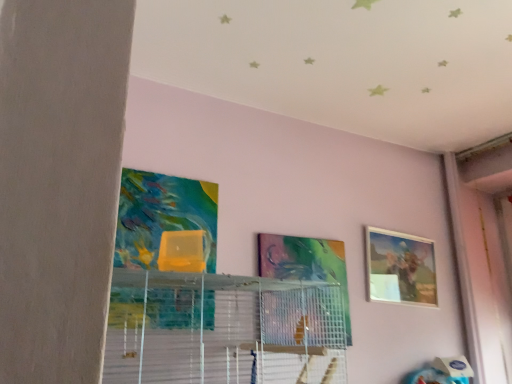
Question: From a real-world perspective, is clear plastic shelf at center under matte wooden picture frame at upper right, which appears as the 1th picture frame when viewed from the back?

Choices:
 (A) no
 (B) yes

Answer: (B)

Question: Does clear plastic shelf at center have a lesser height compared to matte wooden picture frame at upper right, which appears as the 1th picture frame when viewed from the back?

Choices:
 (A) yes
 (B) no

Answer: (A)

Question: Is clear plastic shelf at center further to the viewer compared to matte wooden picture frame at upper right, marked as the second picture frame in a left-to-right arrangement?

Choices:
 (A) no
 (B) yes

Answer: (A)

Question: Is clear plastic shelf at center to the left of matte wooden picture frame at upper right, which ranks as the second picture frame in front-to-back order, from the viewer's perspective?

Choices:
 (A) no
 (B) yes

Answer: (B)

Question: From the image's perspective, is clear plastic shelf at center below matte wooden picture frame at upper right, marked as the second picture frame in a left-to-right arrangement?

Choices:
 (A) yes
 (B) no

Answer: (A)

Question: Based on their positions, is clear plastic shelf at center located to the left or right of metallic silver picture frame at center, which appears as the 2th picture frame when viewed from the back?

Choices:
 (A) left
 (B) right

Answer: (A)

Question: In terms of height, does clear plastic shelf at center look taller or shorter compared to metallic silver picture frame at center, which appears as the 2th picture frame when viewed from the back?

Choices:
 (A) tall
 (B) short

Answer: (B)

Question: Is point (174, 354) closer or farther from the camera than point (267, 274)?

Choices:
 (A) closer
 (B) farther

Answer: (A)

Question: Considering their positions, is clear plastic shelf at center located in front of or behind metallic silver picture frame at center, which appears as the second picture frame when viewed from the right?

Choices:
 (A) behind
 (B) front

Answer: (B)

Question: Is matte wooden picture frame at upper right, which ranks as the second picture frame in front-to-back order, taller or shorter than metallic silver picture frame at center, which appears as the second picture frame when viewed from the right?

Choices:
 (A) short
 (B) tall

Answer: (A)

Question: From a real-world perspective, is matte wooden picture frame at upper right, which is the first picture frame in right-to-left order, above or below metallic silver picture frame at center, which is the first picture frame from front to back?

Choices:
 (A) below
 (B) above

Answer: (B)

Question: Does point (407, 299) appear closer or farther from the camera than point (347, 317)?

Choices:
 (A) farther
 (B) closer

Answer: (A)

Question: Is matte wooden picture frame at upper right, which ranks as the second picture frame in front-to-back order, inside or outside of metallic silver picture frame at center, which appears as the second picture frame when viewed from the right?

Choices:
 (A) inside
 (B) outside

Answer: (B)

Question: Considering the positions of metallic silver picture frame at center, the first picture frame in the left-to-right sequence, and matte wooden picture frame at upper right, marked as the second picture frame in a left-to-right arrangement, in the image, is metallic silver picture frame at center, the first picture frame in the left-to-right sequence, bigger or smaller than matte wooden picture frame at upper right, marked as the second picture frame in a left-to-right arrangement,?

Choices:
 (A) small
 (B) big

Answer: (A)

Question: From a real-world perspective, is metallic silver picture frame at center, the first picture frame in the left-to-right sequence, positioned above or below matte wooden picture frame at upper right, marked as the second picture frame in a left-to-right arrangement?

Choices:
 (A) above
 (B) below

Answer: (B)